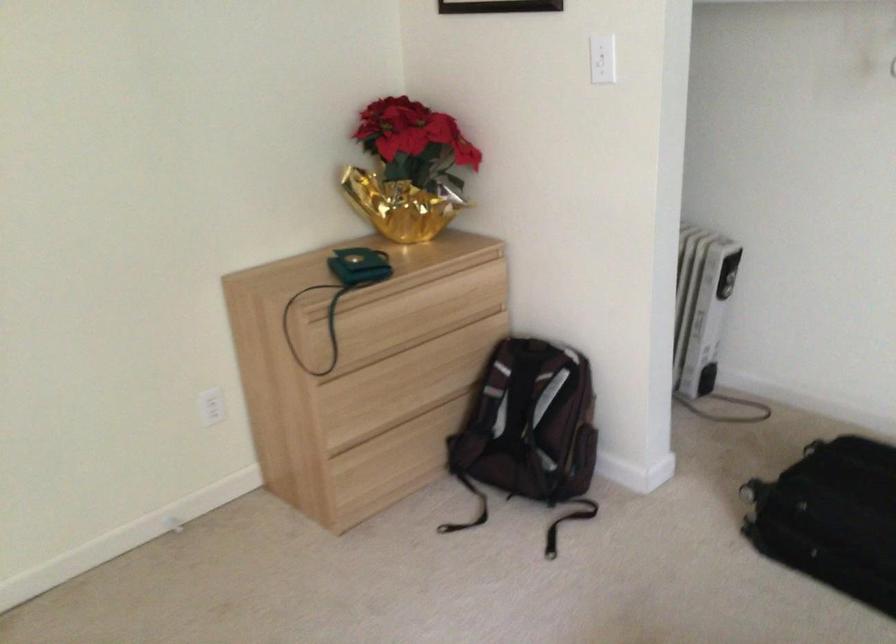
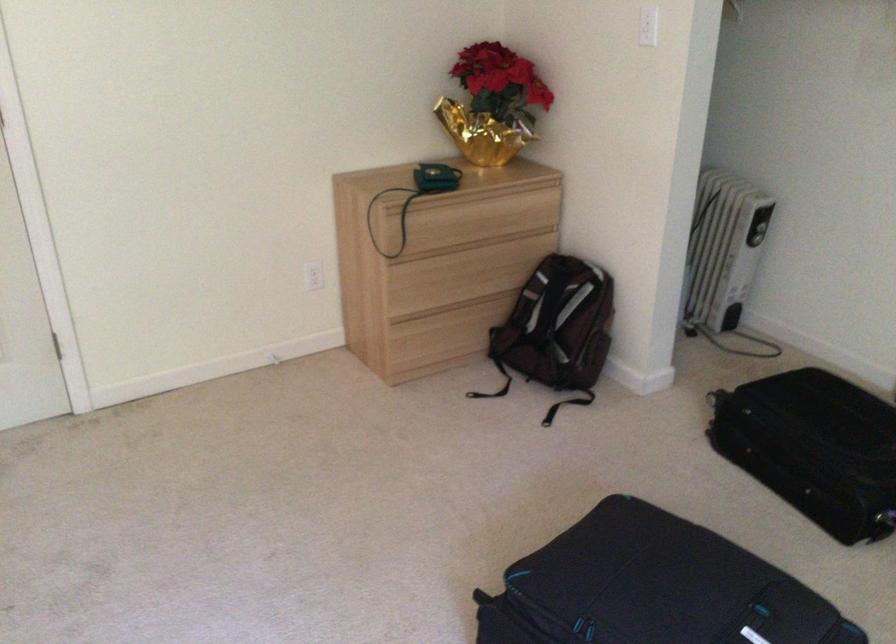
The point at (523,362) is marked in the first image. Where is the corresponding point in the second image?

(558, 272)